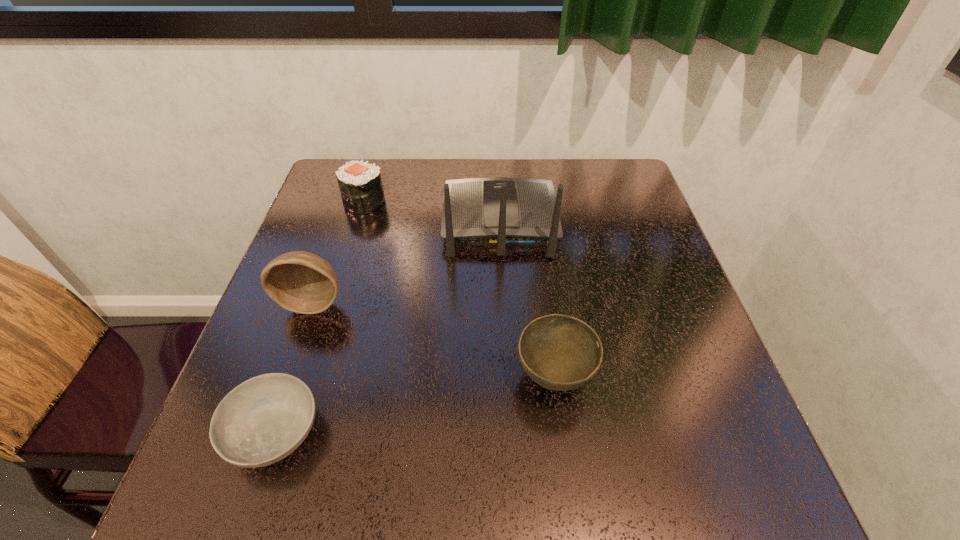
Locate an element on the screen. free space between the sushi and the rightmost bowl is located at coordinates (459, 289).

This screenshot has width=960, height=540. In order to click on empty space between the router and the shortest bowl in this screenshot , I will do `click(388, 327)`.

The height and width of the screenshot is (540, 960). What are the coordinates of `object that can be found as the second closest to the sushi` in the screenshot? It's located at (302, 282).

Where is `object identified as the closest to the second tallest bowl`? object identified as the closest to the second tallest bowl is located at coordinates (498, 211).

At what (x,y) coordinates should I click in order to perform the action: click on bowl that is the third nearest to the sushi. Please return your answer as a coordinate pair (x, y). The width and height of the screenshot is (960, 540). Looking at the image, I should click on (559, 352).

Point out which bowl is positioned as the second nearest to the second tallest bowl. Please provide its 2D coordinates. Your answer should be formatted as a tuple, i.e. [(x, y)], where the tuple contains the x and y coordinates of a point satisfying the conditions above.

[(302, 282)]